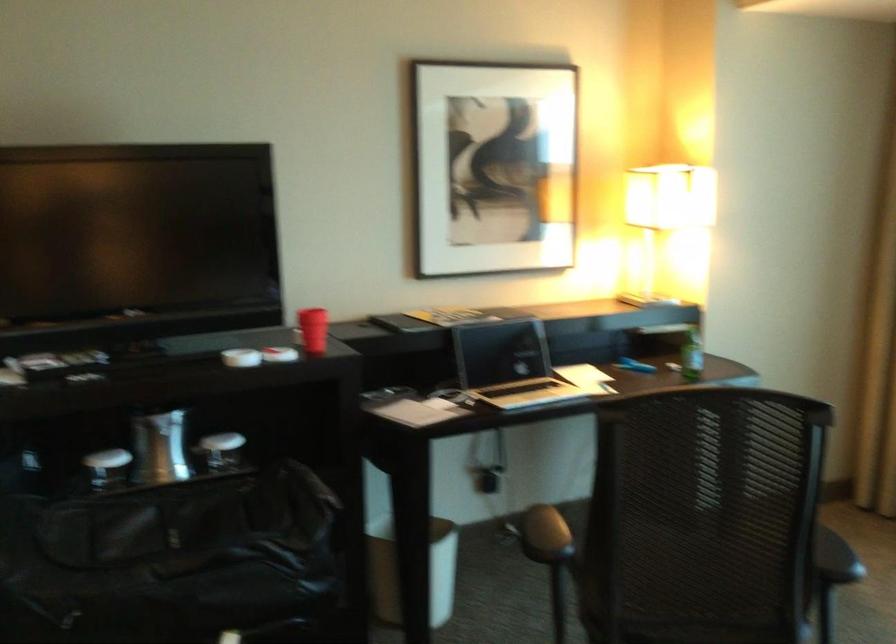
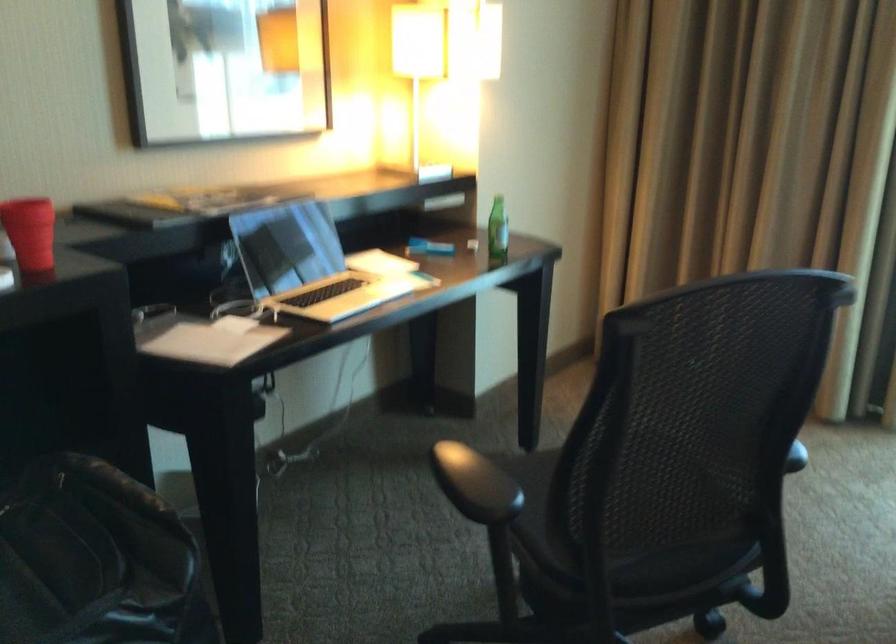
Locate, in the second image, the point that corresponds to point (452, 391) in the first image.

(237, 304)